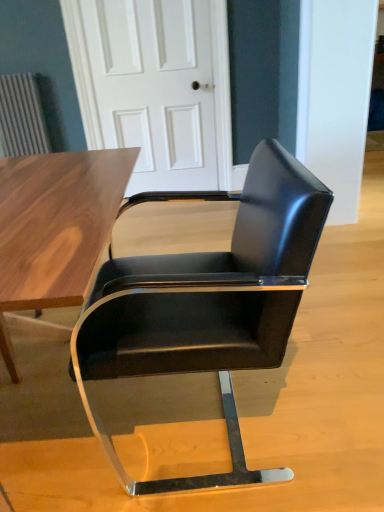
Locate an element on the screen. The width and height of the screenshot is (384, 512). vacant area that lies to the right of black leather chair at center is located at coordinates (332, 386).